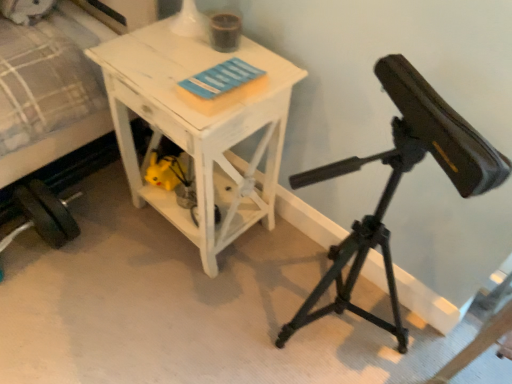
The image size is (512, 384). I want to click on free space between white distressed wood table at center and black matte tripod at right, so click(x=268, y=279).